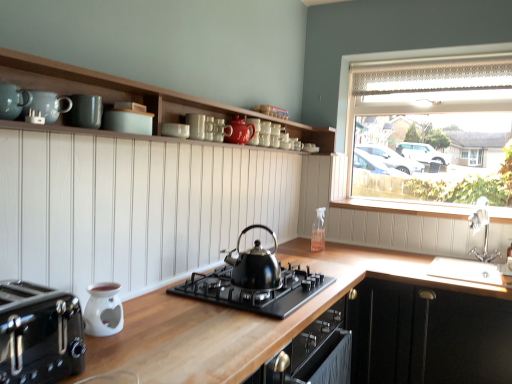
Question: Which direction should I rotate to face wooden shelves at upper center, the 1th cabinetry positioned from the top, — up or down?

Choices:
 (A) down
 (B) up

Answer: (B)

Question: From the image's perspective, is white ceramic sink at right beneath black matte cabinet at lower right, which appears as the second cabinetry when viewed from the top?

Choices:
 (A) yes
 (B) no

Answer: (B)

Question: Is white ceramic sink at right completely or partially outside of black matte cabinet at lower right, which appears as the 1th cabinetry when viewed from the right?

Choices:
 (A) no
 (B) yes

Answer: (B)

Question: Considering the relative sizes of white ceramic sink at right and black matte cabinet at lower right, marked as the second cabinetry in a left-to-right arrangement, in the image provided, is white ceramic sink at right wider than black matte cabinet at lower right, marked as the second cabinetry in a left-to-right arrangement,?

Choices:
 (A) yes
 (B) no

Answer: (B)

Question: Are white ceramic sink at right and black matte cabinet at lower right, the first cabinetry in the bottom-to-top sequence, far apart?

Choices:
 (A) yes
 (B) no

Answer: (B)

Question: Is white ceramic sink at right thinner than black matte cabinet at lower right, which appears as the 1th cabinetry when viewed from the right?

Choices:
 (A) no
 (B) yes

Answer: (B)

Question: Does white ceramic sink at right come in front of black matte cabinet at lower right, marked as the second cabinetry in a left-to-right arrangement?

Choices:
 (A) yes
 (B) no

Answer: (B)

Question: Can you confirm if white ceramic oil burner at lower left, the first kitchen appliance viewed from the back, is wider than black polished kettle at center?

Choices:
 (A) yes
 (B) no

Answer: (B)

Question: Is white ceramic oil burner at lower left, the first kitchen appliance viewed from the back, thinner than black polished kettle at center?

Choices:
 (A) no
 (B) yes

Answer: (B)

Question: Would you consider white ceramic oil burner at lower left, which appears as the 2th kitchen appliance when viewed from the front, to be distant from black polished kettle at center?

Choices:
 (A) yes
 (B) no

Answer: (B)

Question: Considering the relative sizes of white ceramic oil burner at lower left, which appears as the 2th kitchen appliance when viewed from the front, and black polished kettle at center in the image provided, is white ceramic oil burner at lower left, which appears as the 2th kitchen appliance when viewed from the front, bigger than black polished kettle at center?

Choices:
 (A) no
 (B) yes

Answer: (A)

Question: Does white ceramic oil burner at lower left, the first kitchen appliance viewed from the back, have a greater height compared to black polished kettle at center?

Choices:
 (A) yes
 (B) no

Answer: (B)

Question: Is white ceramic oil burner at lower left, the first kitchen appliance viewed from the back, at the right side of black polished kettle at center?

Choices:
 (A) no
 (B) yes

Answer: (A)

Question: Can you confirm if clear glass spray bottle at upper right is positioned to the right of teal matte mugs at upper center, arranged as the 2th teal when viewed from the front?

Choices:
 (A) yes
 (B) no

Answer: (A)